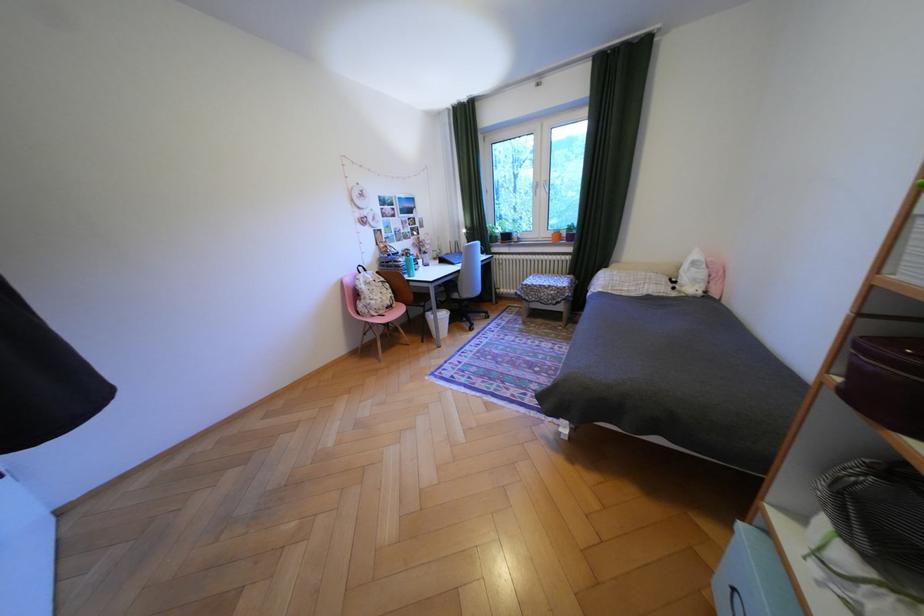
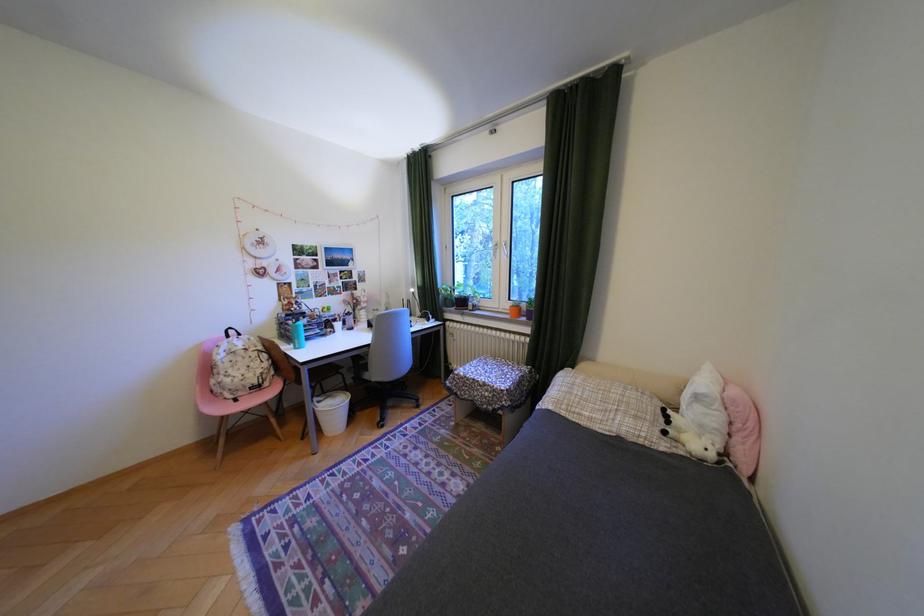
Find the pixel in the second image that matches point (706, 270) in the first image.

(710, 408)